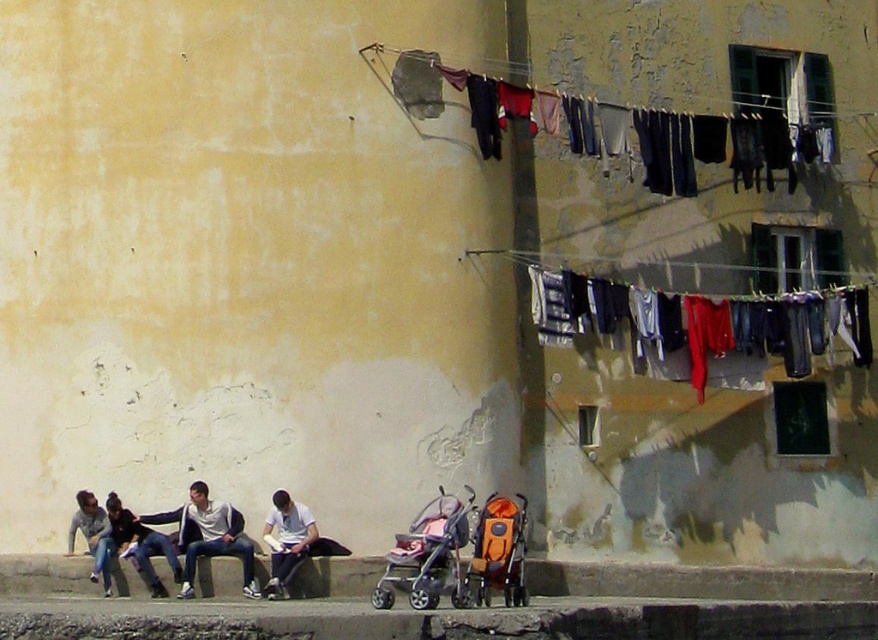
Question: Which of the following is the farthest from the observer?

Choices:
 (A) [x=745, y=161]
 (B) [x=615, y=316]

Answer: (A)

Question: Among these points, which one is nearest to the camera?

Choices:
 (A) (301, 557)
 (B) (87, 509)
 (C) (191, 512)
 (D) (393, 579)

Answer: (D)

Question: Is concrete curb at lower left positioned behind denim jeans at lower left?

Choices:
 (A) yes
 (B) no

Answer: (A)

Question: Is concrete curb at lower left below pink fabric baby carriage at center?

Choices:
 (A) no
 (B) yes

Answer: (B)

Question: Can you confirm if denim jeans at right is positioned above white cotton shirt at center?

Choices:
 (A) yes
 (B) no

Answer: (A)

Question: Which object is positioned farthest from the denim jeans at right?

Choices:
 (A) dark gray jeans at lower left
 (B) concrete curb at lower left
 (C) pink fabric baby carriage at center

Answer: (C)